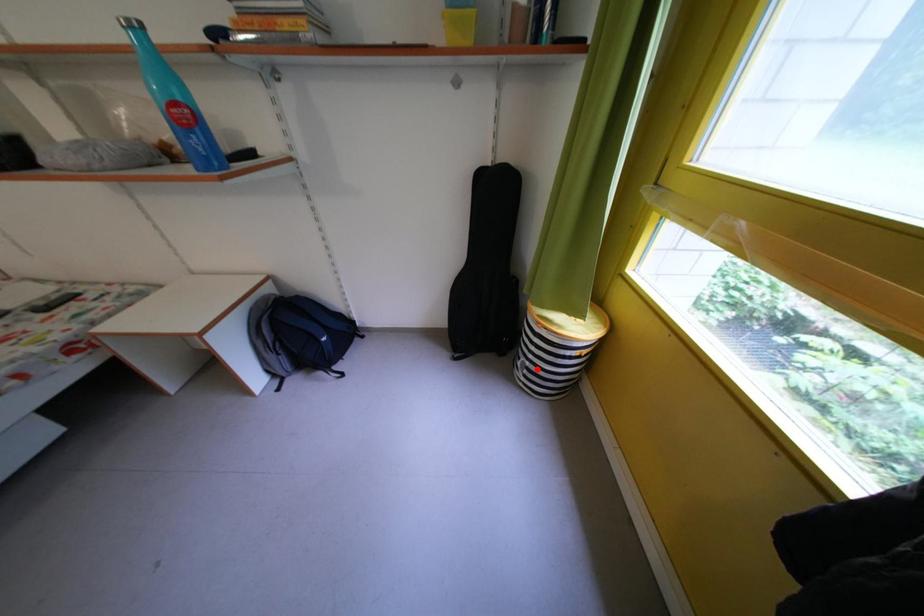
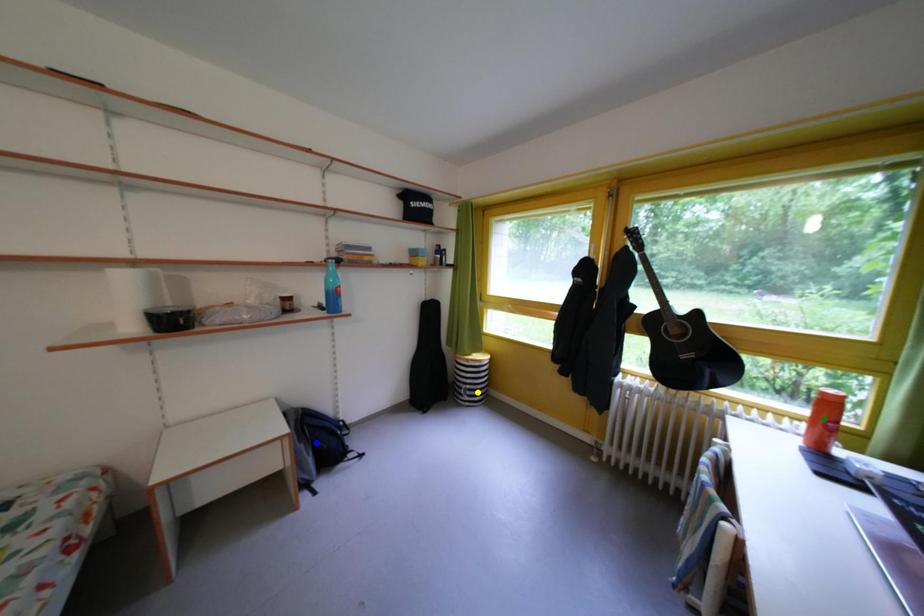
Question: I am providing you with two images of the same scene from different viewpoints. A red point is marked on the first image. You are given multiple points on the second image. Which spot in image 2 lines up with the point in image 1?

Choices:
 (A) yellow point
 (B) green point
 (C) blue point

Answer: (A)